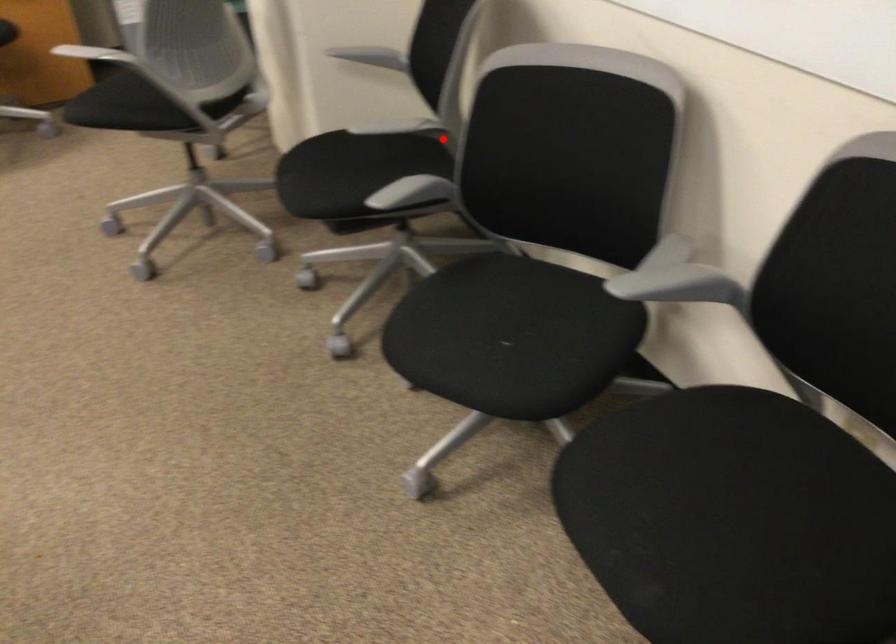
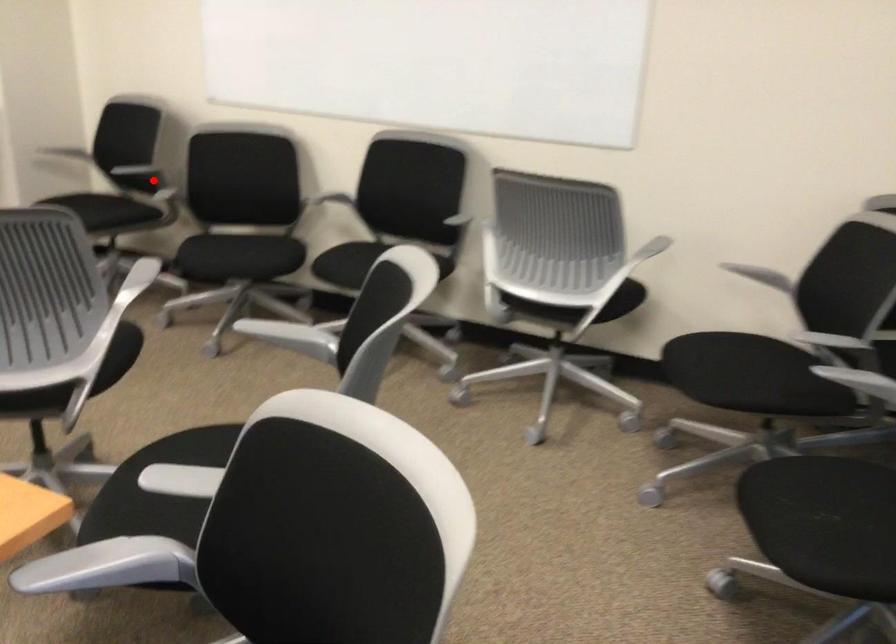
I am providing you with two images of the same scene from different viewpoints. A red point is marked on the first image and another point is marked on the second image. Does the point marked in image1 correspond to the same location as the one in image2?

Yes